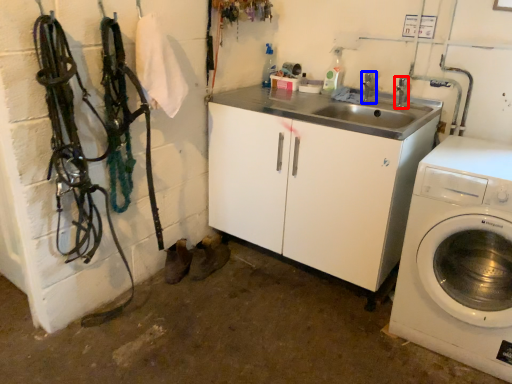
Question: Which object is closer to the camera taking this photo, faucet (highlighted by a red box) or faucet (highlighted by a blue box)?

Choices:
 (A) faucet
 (B) faucet

Answer: (A)